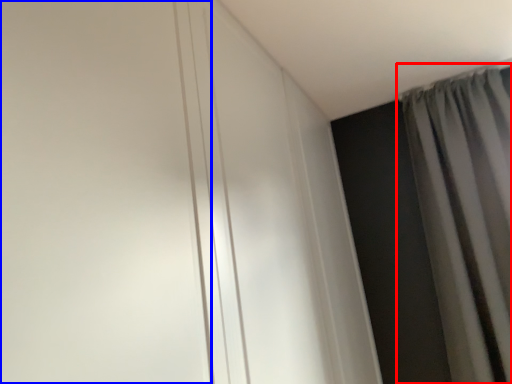
Question: Which point is further to the camera, curtain (highlighted by a red box) or door (highlighted by a blue box)?

Choices:
 (A) curtain
 (B) door

Answer: (A)